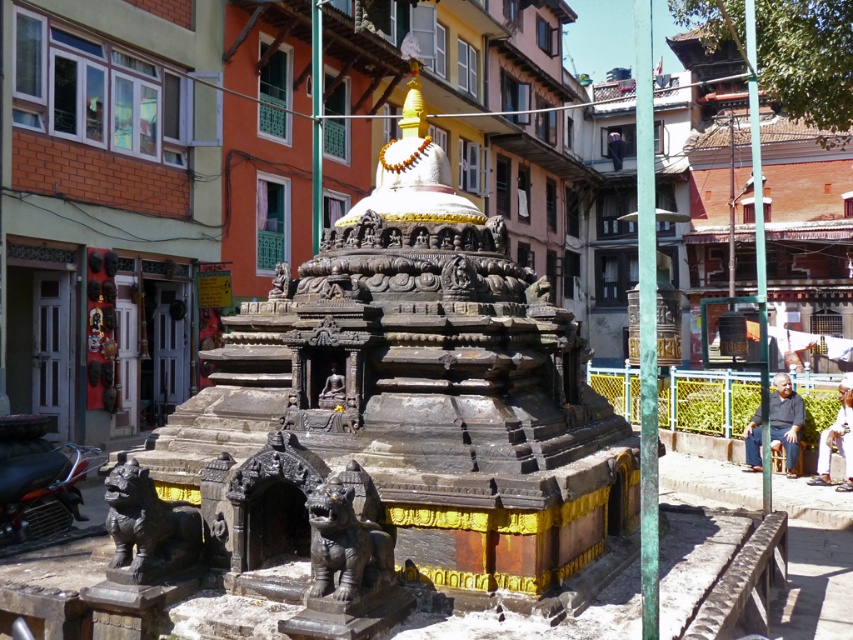
You are a delivery person trying to park your shiny black motorcycle at lower left near the temple entrance. There is a polished bronze lion at lower left already occupying some space. Based on the scene, can your motorcycle fit in the remaining space next to the lion?

The polished bronze lion at lower left occupies less space than the shiny black motorcycle at lower left, so there might still be enough space for the motorcycle to fit next to the lion, but it would be tight.

You are an architect visiting the temple and need to determine the relative sizes of the statues for a restoration project. Which of the two statues, the polished bronze lion at lower left or the bronze statue at center, is smaller?

The polished bronze lion at lower left is smaller compared to the bronze statue at center.